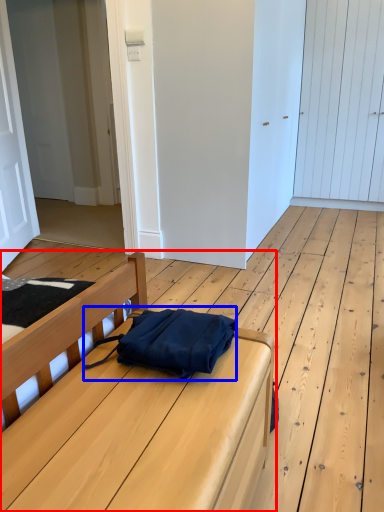
Question: Which point is closer to the camera, furniture (highlighted by a red box) or messenger bag (highlighted by a blue box)?

Choices:
 (A) furniture
 (B) messenger bag

Answer: (A)